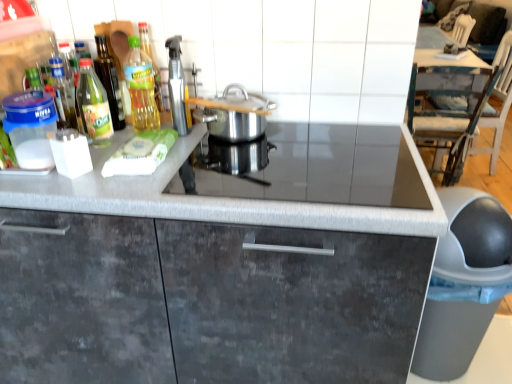
Question: Does gray matte trash can at lower right lie in front of green glass bottle at upper left, which ranks as the 2th kitchen appliance in left-to-right order?

Choices:
 (A) yes
 (B) no

Answer: (A)

Question: Does gray matte trash can at lower right contain green glass bottle at upper left, the third kitchen appliance when ordered from right to left?

Choices:
 (A) no
 (B) yes

Answer: (A)

Question: From a real-world perspective, is gray matte trash can at lower right on top of green glass bottle at upper left, which ranks as the 2th kitchen appliance in left-to-right order?

Choices:
 (A) no
 (B) yes

Answer: (A)

Question: Does gray matte trash can at lower right appear on the right side of green glass bottle at upper left, which ranks as the 2th kitchen appliance in left-to-right order?

Choices:
 (A) no
 (B) yes

Answer: (B)

Question: Is gray matte trash can at lower right positioned with its back to green glass bottle at upper left, the third kitchen appliance when ordered from right to left?

Choices:
 (A) yes
 (B) no

Answer: (B)

Question: From the image's perspective, does gray matte trash can at lower right appear higher than green glass bottle at upper left, the third kitchen appliance when ordered from right to left?

Choices:
 (A) no
 (B) yes

Answer: (A)

Question: Is black glass gas stove at center directly adjacent to green glass bottle at upper left, which ranks as the 2th kitchen appliance in left-to-right order?

Choices:
 (A) yes
 (B) no

Answer: (B)

Question: Can green glass bottle at upper left, which ranks as the 2th kitchen appliance in left-to-right order, be found inside black glass gas stove at center?

Choices:
 (A) yes
 (B) no

Answer: (B)

Question: Considering the relative sizes of black glass gas stove at center and green glass bottle at upper left, which ranks as the 2th kitchen appliance in left-to-right order, in the image provided, is black glass gas stove at center shorter than green glass bottle at upper left, which ranks as the 2th kitchen appliance in left-to-right order,?

Choices:
 (A) no
 (B) yes

Answer: (B)

Question: Does black glass gas stove at center appear on the right side of green glass bottle at upper left, which ranks as the 2th kitchen appliance in left-to-right order?

Choices:
 (A) no
 (B) yes

Answer: (B)

Question: From the image's perspective, is black glass gas stove at center under green glass bottle at upper left, the third kitchen appliance when ordered from right to left?

Choices:
 (A) yes
 (B) no

Answer: (A)

Question: Is black glass gas stove at center oriented away from green glass bottle at upper left, the third kitchen appliance when ordered from right to left?

Choices:
 (A) no
 (B) yes

Answer: (A)

Question: Is green glass bottle at upper left, the third kitchen appliance when ordered from right to left, located within polished stainless steel pot at center, acting as the fourth kitchen appliance starting from the left?

Choices:
 (A) yes
 (B) no

Answer: (B)